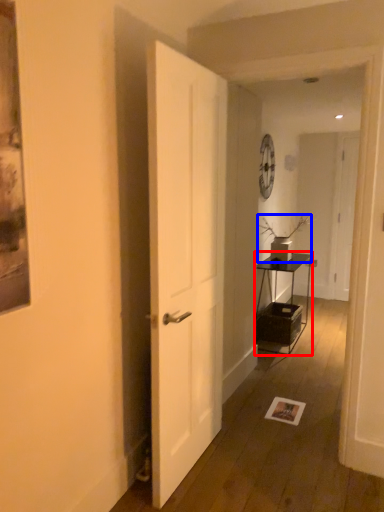
Question: Which of the following is the farthest to the observer, table (highlighted by a red box) or houseplant (highlighted by a blue box)?

Choices:
 (A) table
 (B) houseplant

Answer: (B)